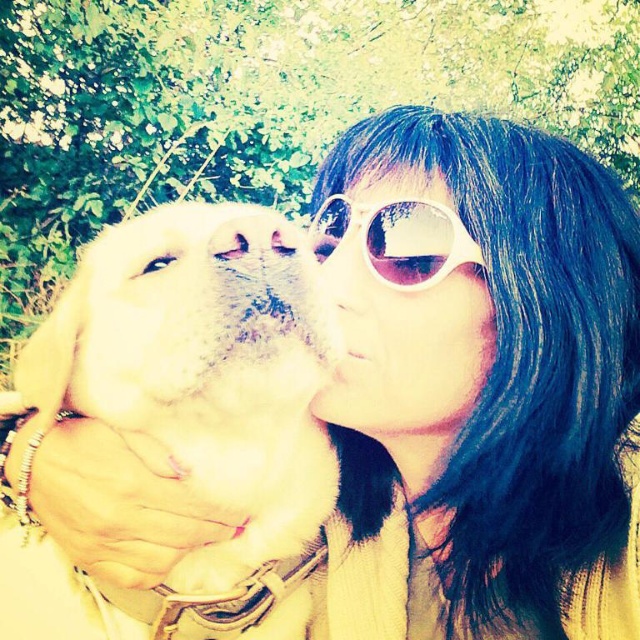
Does white fur dog at left have a lesser height compared to white matte sunglasses at upper center?

No.

Does point (141, 422) come closer to viewer compared to point (452, 422)?

Yes, it is.

Which is behind, point (278, 276) or point (435, 420)?

Point (435, 420)

Image resolution: width=640 pixels, height=640 pixels. I want to click on white fur dog at left, so click(x=182, y=419).

Between point (218, 257) and point (390, 211), which one is positioned behind?

The point (390, 211) is behind.

Is the position of white fur dog at left less distant than that of white plastic goggles at center?

Yes, it is.

Which is behind, point (148, 419) or point (440, 244)?

Positioned behind is point (440, 244).

The height and width of the screenshot is (640, 640). Find the location of `white fur dog at left`. white fur dog at left is located at coordinates (182, 419).

Find the location of a particular element. This screenshot has height=640, width=640. white matte sunglasses at upper center is located at coordinates (403, 305).

Who is more forward, [380,268] or [440,248]?

Point [440,248]

What do you see at coordinates (403, 305) in the screenshot? Image resolution: width=640 pixels, height=640 pixels. I see `white matte sunglasses at upper center` at bounding box center [403, 305].

The width and height of the screenshot is (640, 640). I want to click on white matte sunglasses at upper center, so click(x=403, y=305).